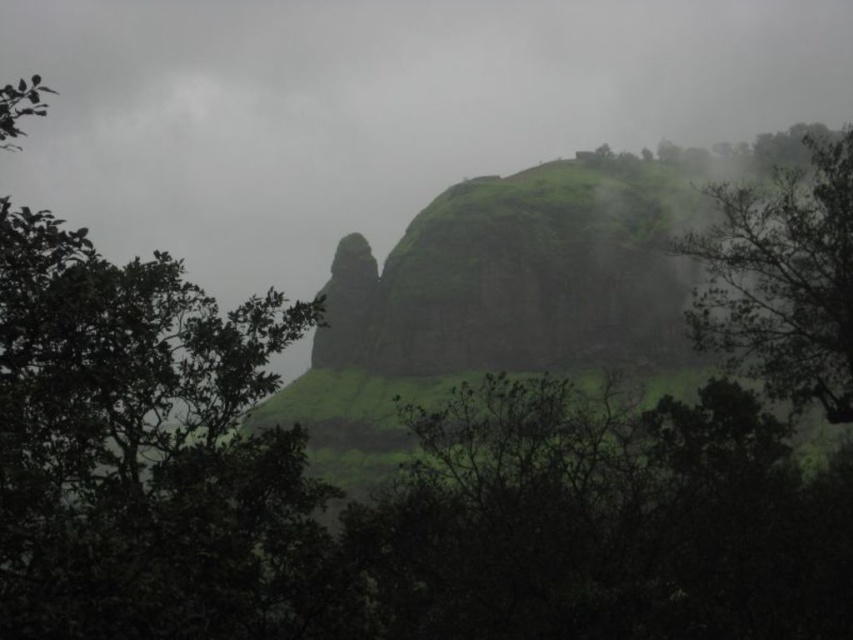
Question: Is green leafy tree at center below green leafy tree at upper right?

Choices:
 (A) yes
 (B) no

Answer: (A)

Question: Considering the relative positions of green leafy tree at center and green leafy tree at upper right in the image provided, where is green leafy tree at center located with respect to green leafy tree at upper right?

Choices:
 (A) below
 (B) above

Answer: (A)

Question: Which point is farther to the camera?

Choices:
 (A) (260, 465)
 (B) (846, 358)

Answer: (B)

Question: Which point is farther to the camera?

Choices:
 (A) (721, 337)
 (B) (67, 292)

Answer: (A)

Question: Does green leafy tree at center appear over green leafy tree at upper right?

Choices:
 (A) no
 (B) yes

Answer: (A)